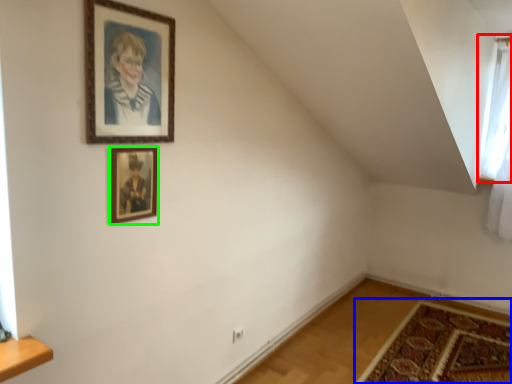
Question: Based on their relative distances, which object is farther from window (highlighted by a red box)? Choose from mat (highlighted by a blue box) and picture frame (highlighted by a green box).

Choices:
 (A) mat
 (B) picture frame

Answer: (B)